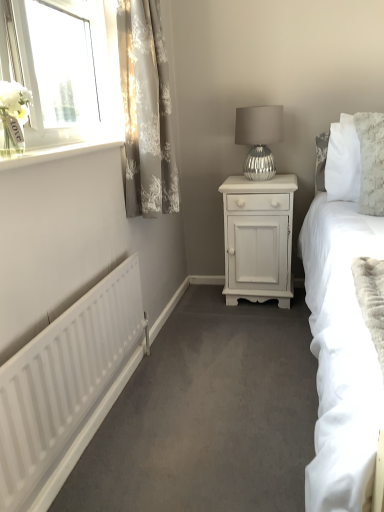
Identify the location of spots to the right of white matte radiator at lower left. The image size is (384, 512). (208, 414).